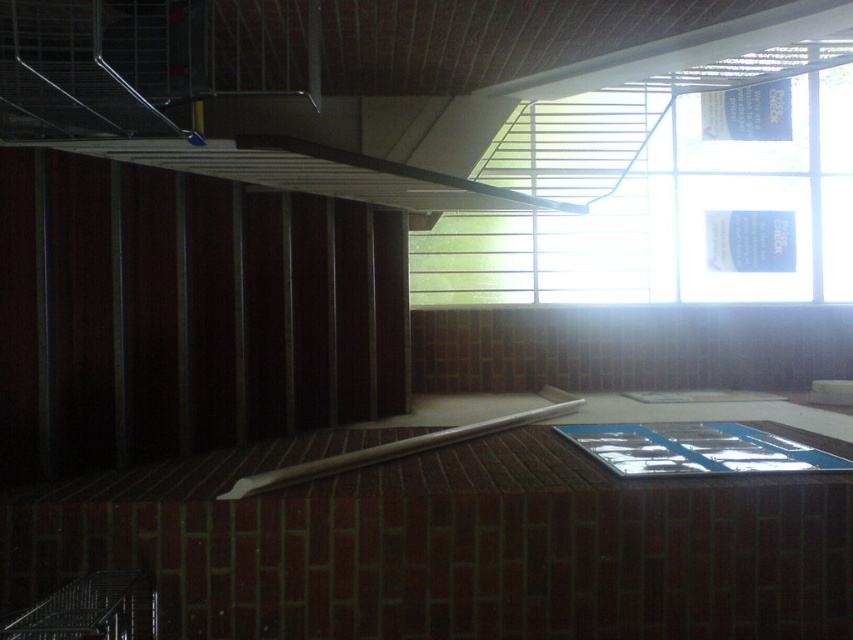
Question: Does clear glass window at upper right lie in front of white wood beam at center?

Choices:
 (A) yes
 (B) no

Answer: (B)

Question: Which of the following is the closest to the observer?

Choices:
 (A) white wood beam at center
 (B) clear glass window at upper right

Answer: (A)

Question: Is clear glass window at upper right wider than white wood beam at center?

Choices:
 (A) no
 (B) yes

Answer: (B)

Question: Which object appears farthest from the camera in this image?

Choices:
 (A) clear glass window at upper right
 (B) white wood beam at center

Answer: (A)

Question: Which object is closer to the camera taking this photo?

Choices:
 (A) clear glass window at upper right
 (B) white wood beam at center

Answer: (B)

Question: Does clear glass window at upper right appear on the left side of white wood beam at center?

Choices:
 (A) no
 (B) yes

Answer: (A)